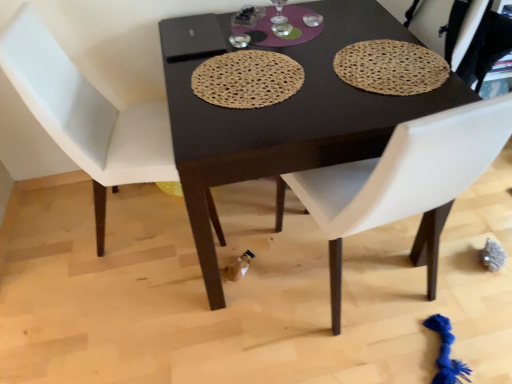
Identify the location of vacant space positioned to the left of brown woven placemat at upper right, the second mat viewed from the left. (289, 75).